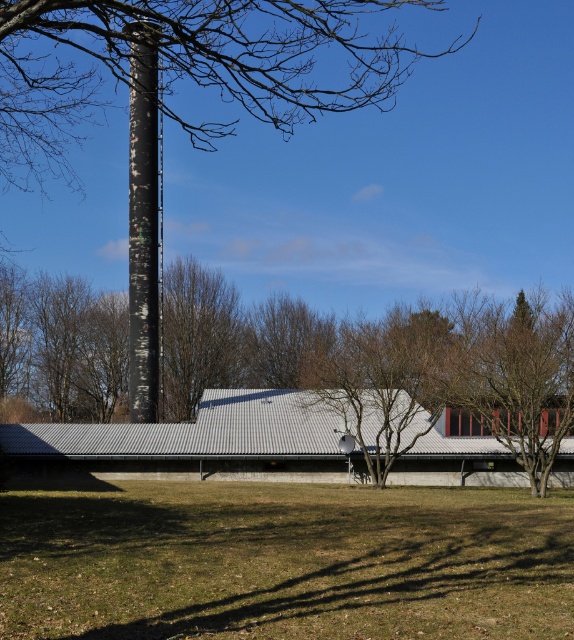
You are standing at the edge of the green grass at lower center and want to walk towards the black matte chimney at center. Which direction should you head?

Since the green grass at lower center is closer to you than the black matte chimney at center, you should head towards the center of the image to reach the chimney.

You are a bird looking for a higher perch. You see the gray corrugated metal barn at center and the black matte chimney at center. Which one should you choose to get a higher vantage point?

The black matte chimney at center is taller than the gray corrugated metal barn at center, so you should choose the black matte chimney at center for a higher vantage point.